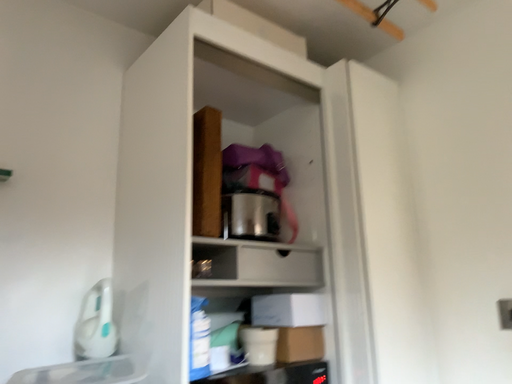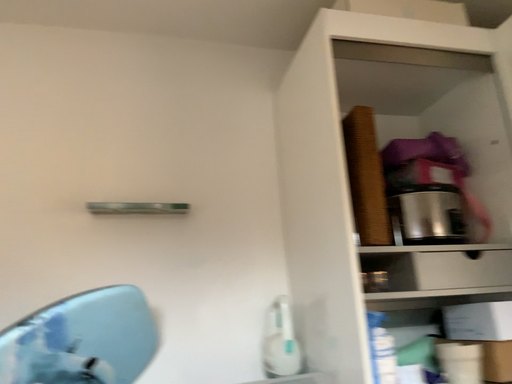
Question: Which way did the camera rotate in the video?

Choices:
 (A) rotated left
 (B) rotated right

Answer: (A)